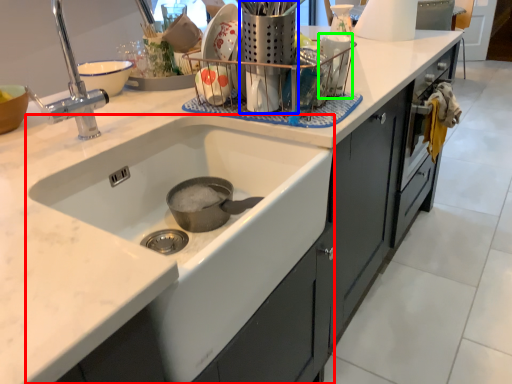
Question: Based on their relative distances, which object is nearer to sink (highlighted by a red box)? Choose from appliance (highlighted by a blue box) and appliance (highlighted by a green box).

Choices:
 (A) appliance
 (B) appliance

Answer: (A)